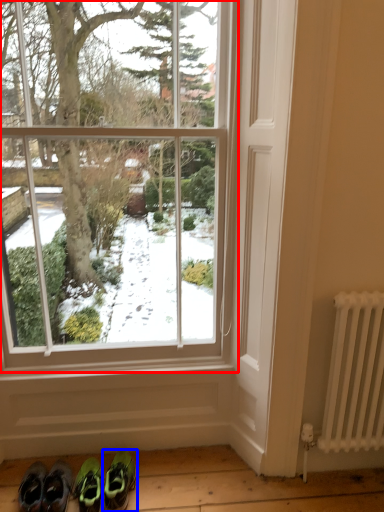
Question: Which object appears closest to the camera in this image, window (highlighted by a red box) or footwear (highlighted by a blue box)?

Choices:
 (A) window
 (B) footwear

Answer: (A)